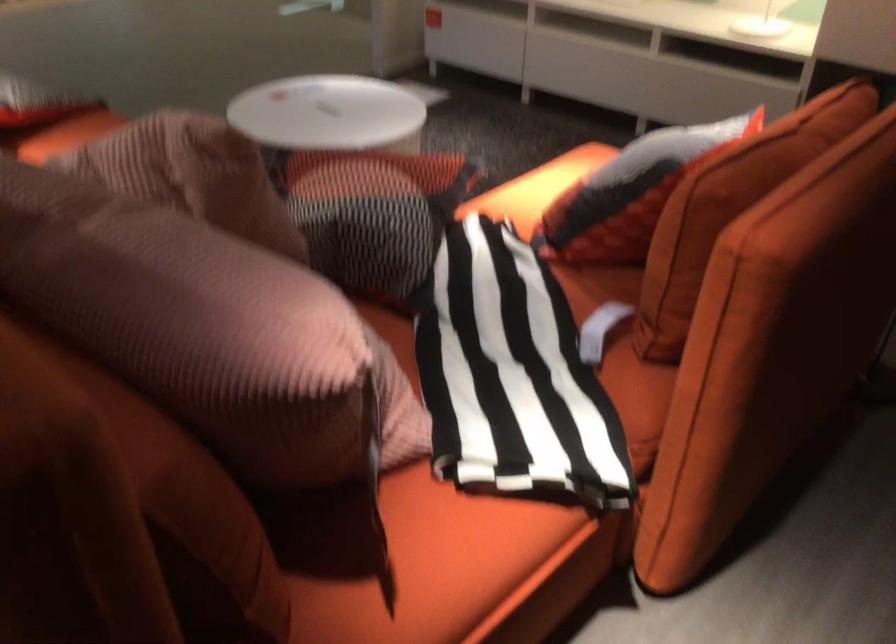
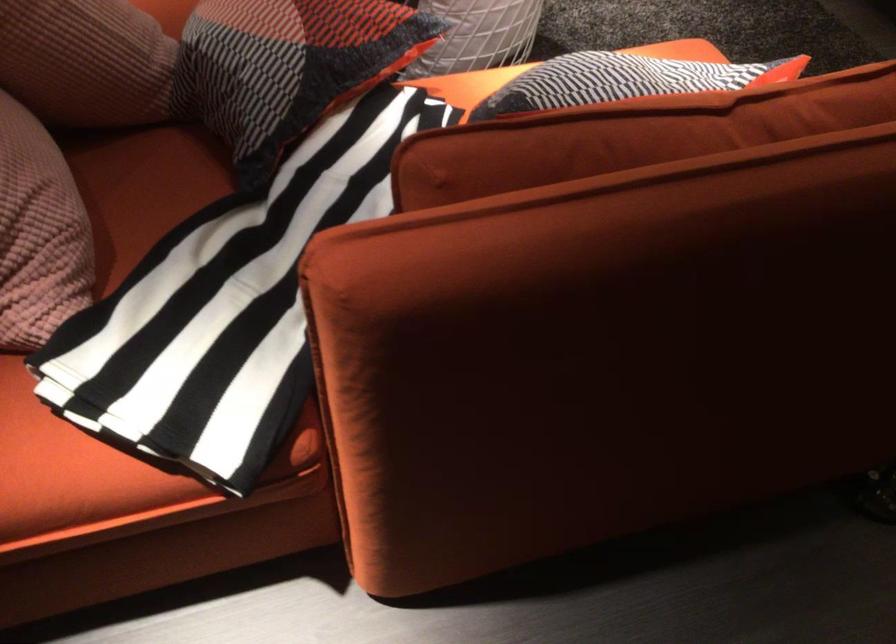
The point at [423,207] is marked in the first image. Where is the corresponding point in the second image?

(288, 67)